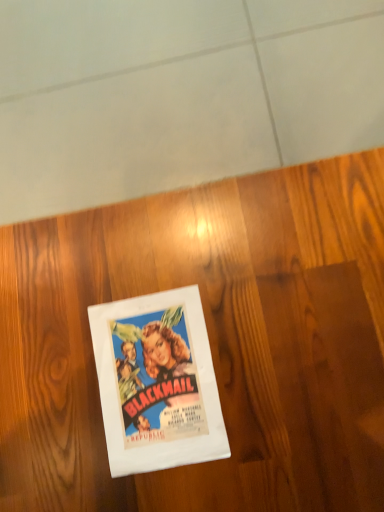
Question: Is white paper at center inside the boundaries of wooden at center, or outside?

Choices:
 (A) outside
 (B) inside

Answer: (B)

Question: Is point (137, 306) positioned closer to the camera than point (160, 264)?

Choices:
 (A) farther
 (B) closer

Answer: (B)

Question: Is white paper at center wider or thinner than wooden at center?

Choices:
 (A) wide
 (B) thin

Answer: (B)

Question: Considering their positions, is wooden at center located in front of or behind white paper at center?

Choices:
 (A) behind
 (B) front

Answer: (B)

Question: Looking at the image, does wooden at center seem bigger or smaller compared to white paper at center?

Choices:
 (A) big
 (B) small

Answer: (A)

Question: In the image, is wooden at center on the left side or the right side of white paper at center?

Choices:
 (A) left
 (B) right

Answer: (B)

Question: In terms of width, does wooden at center look wider or thinner when compared to white paper at center?

Choices:
 (A) thin
 (B) wide

Answer: (B)